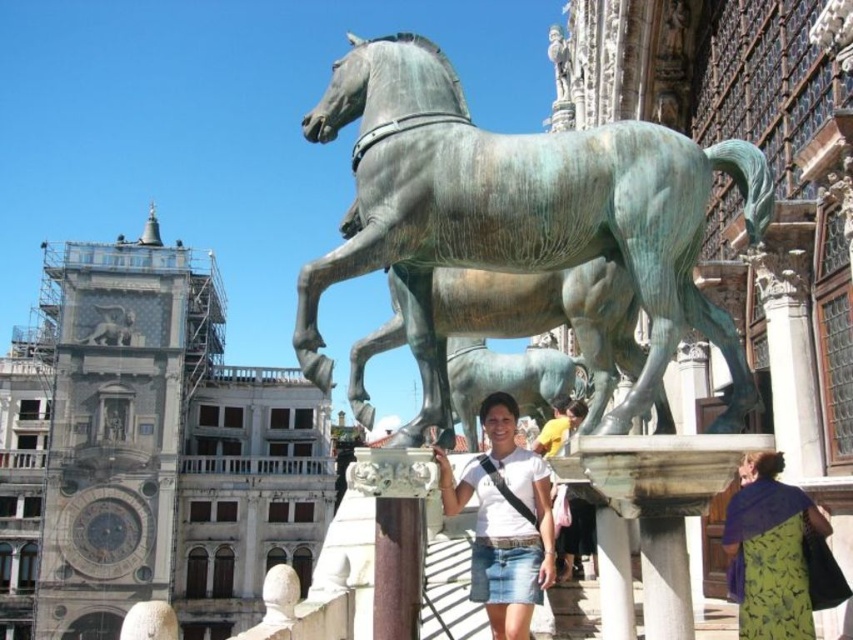
Does green floral dress at lower right lie behind bronze statue at upper center?

No, it is in front of bronze statue at upper center.

Who is lower down, green floral dress at lower right or bronze statue at upper center?

green floral dress at lower right

Which is behind, point (775, 570) or point (126, 337)?

The point (126, 337) is more distant.

Locate an element on the screen. The width and height of the screenshot is (853, 640). green floral dress at lower right is located at coordinates (770, 550).

From the picture: Can you confirm if white fabric shirt at center is thinner than green floral dress at lower right?

In fact, white fabric shirt at center might be wider than green floral dress at lower right.

Is white fabric shirt at center below green floral dress at lower right?

Actually, white fabric shirt at center is above green floral dress at lower right.

The width and height of the screenshot is (853, 640). What are the coordinates of `white fabric shirt at center` in the screenshot? It's located at (503, 520).

Is green patina bronze horse at center smaller than green floral dress at lower right?

No, green patina bronze horse at center is not smaller than green floral dress at lower right.

Does green patina bronze horse at center have a greater height compared to green floral dress at lower right?

Yes.

Between point (738, 396) and point (743, 516), which one is positioned behind?

Point (743, 516)

Where is `green patina bronze horse at center`? green patina bronze horse at center is located at coordinates (517, 216).